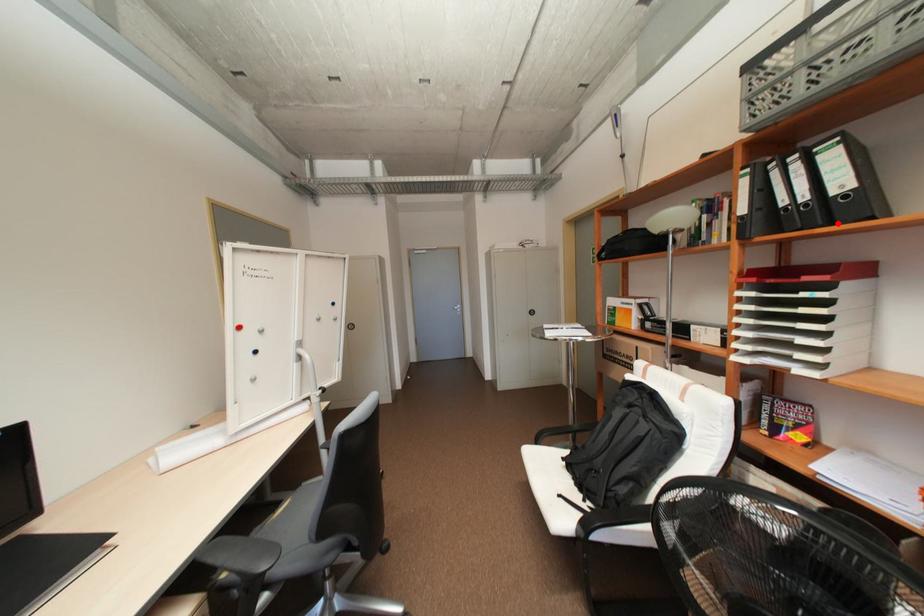
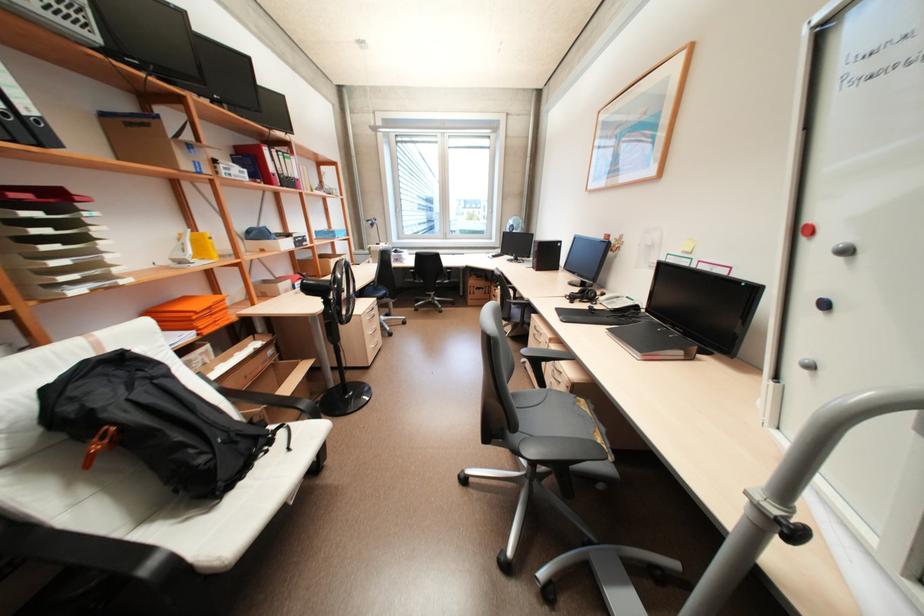
The point at the highlighted location is marked in the first image. Where is the corresponding point in the second image?

(46, 146)